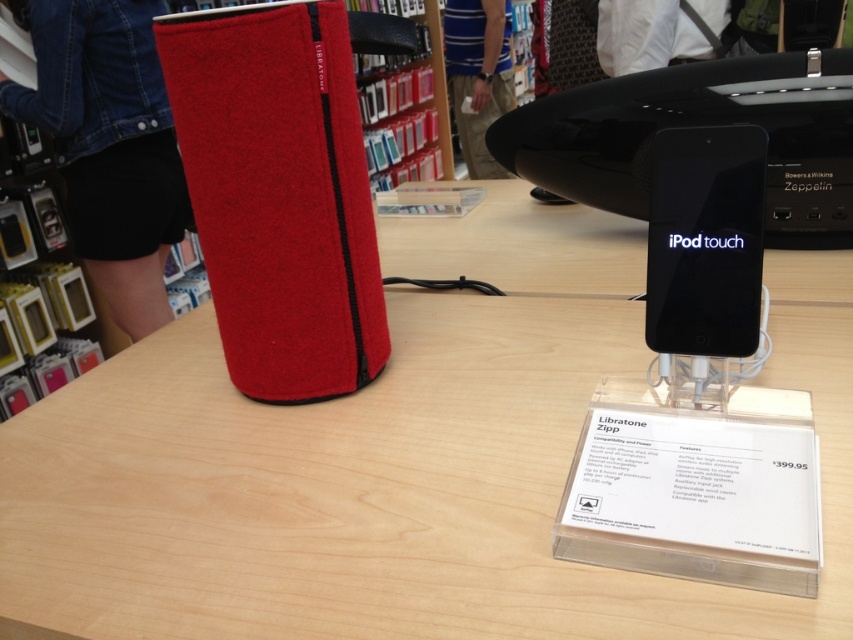
You are a store employee who needs to place a new product catalog on the wooden table at center. The catalog is 12 inches wide. Can you fit it on the table without overlapping any existing items?

The wooden table at center has sufficient space to accommodate the 12 inch catalog without overlapping existing items as there are no objects described as occupying its surface besides the Libratone Zipp speaker and the acrylic stand with iPod touch. However, the exact dimensions of the table aren inference beyond the provided data, so placement depends on available space around the existing items.

What is located at the coordinates point (398, 461) in the retail display?

The wooden table at center is located at point (398, 461).